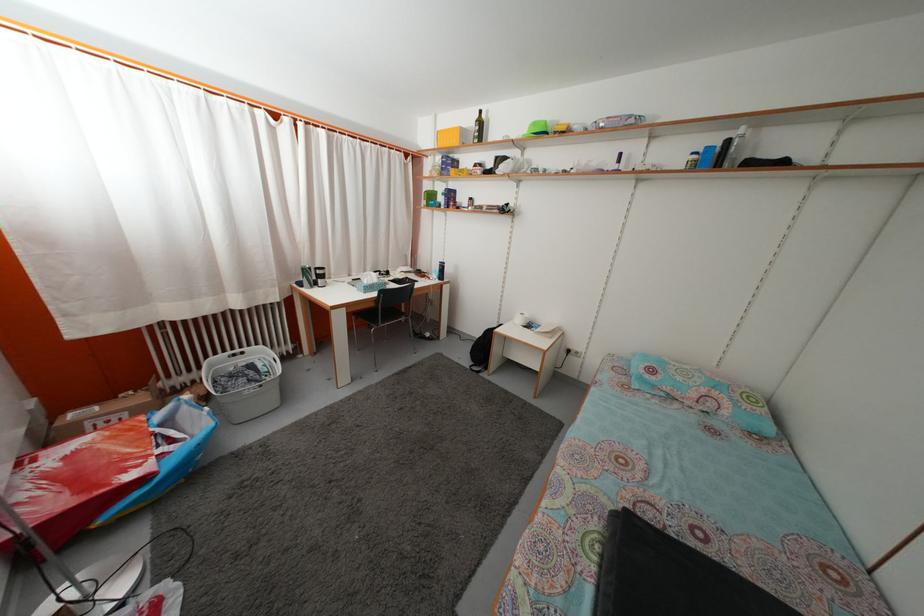
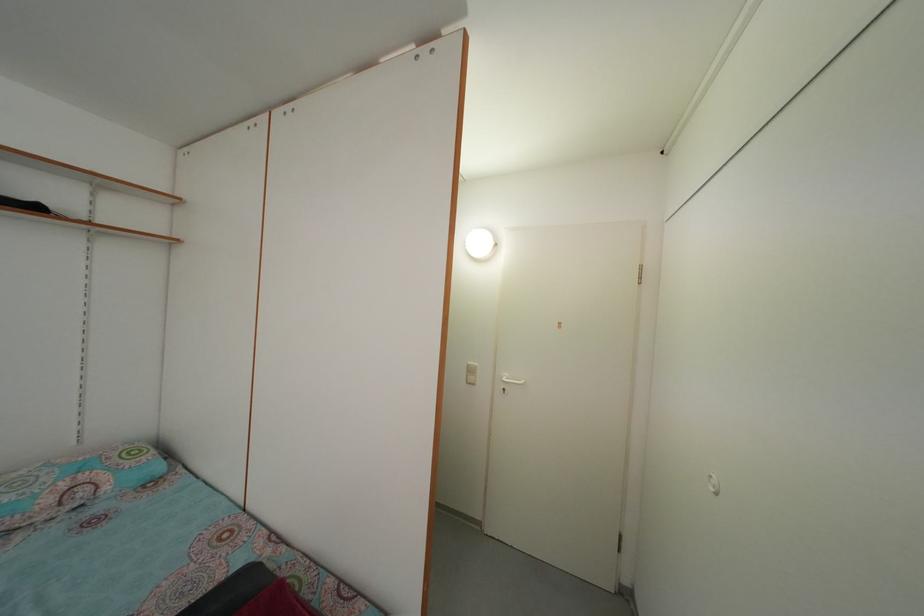
Question: The camera is either moving clockwise (left) or counter-clockwise (right) around the object. The first image is from the beginning of the video and the second image is from the end. Is the camera moving left or right when shooting the video?

Choices:
 (A) Left
 (B) Right

Answer: (A)